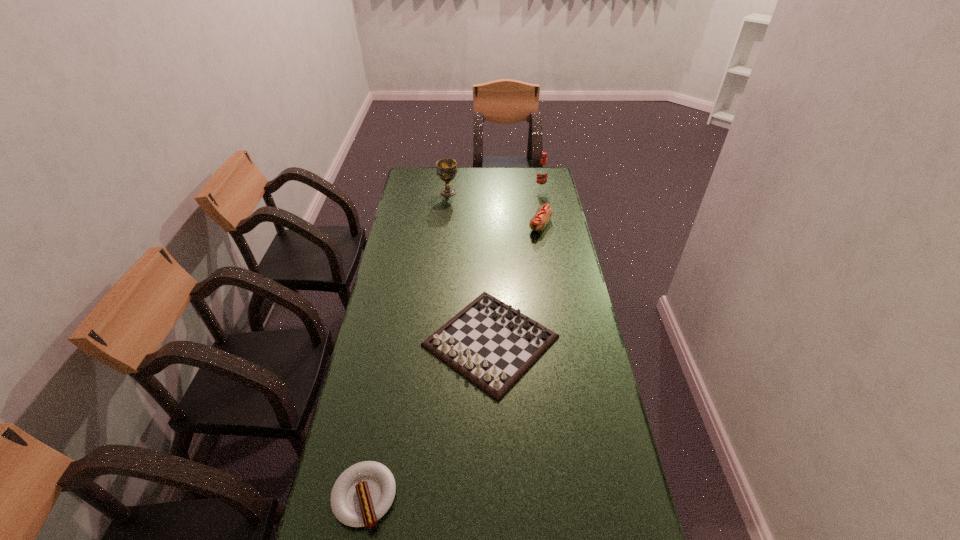
In order to click on the tallest object in this screenshot , I will do (542, 173).

Where is `the fourth shortest object`? Image resolution: width=960 pixels, height=540 pixels. the fourth shortest object is located at coordinates (446, 168).

Locate an element on the screen. the farther sausage is located at coordinates (544, 213).

You are a GUI agent. You are given a task and a screenshot of the screen. Output one action in this format:
    pyautogui.click(x=<x>, y=<y>)
    Task: Click on the right sausage
    Image resolution: width=960 pixels, height=540 pixels.
    Given the screenshot: What is the action you would take?
    pyautogui.click(x=544, y=213)

Find the location of a particular element. chessboard is located at coordinates (491, 344).

In order to click on the shortest object in this screenshot , I will do [363, 493].

At what (x,y) coordinates should I click in order to perform the action: click on the left sausage. Please return your answer as a coordinate pair (x, y). The width and height of the screenshot is (960, 540). Looking at the image, I should click on (363, 493).

Locate an element on the screen. blank area located 0.280m on the front of the tallest object is located at coordinates (548, 225).

Locate an element on the screen. The height and width of the screenshot is (540, 960). free space located on the left of the second tallest object is located at coordinates [x=413, y=192].

At what (x,y) coordinates should I click in order to perform the action: click on vacant space located on the left of the taller sausage. Please return your answer as a coordinate pair (x, y). Looking at the image, I should click on (446, 226).